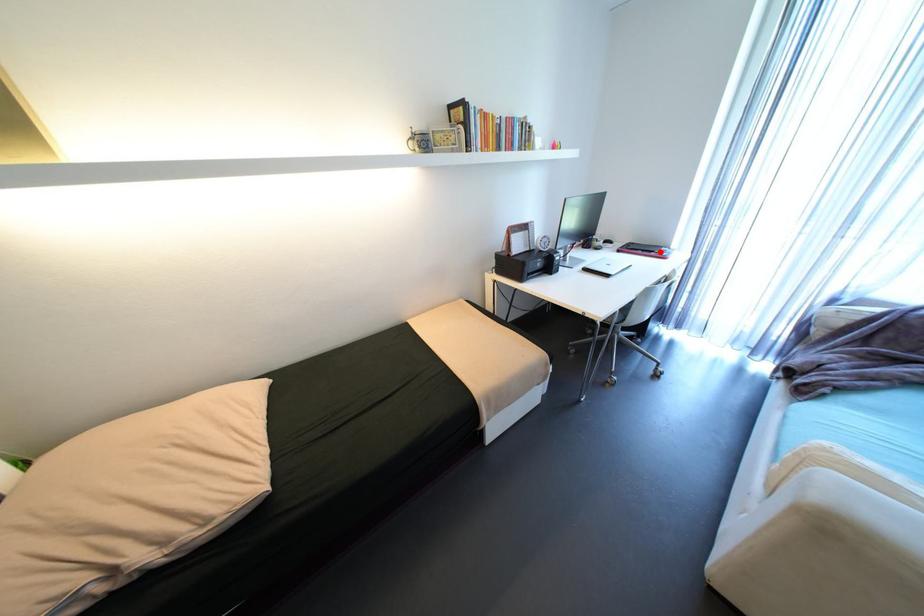
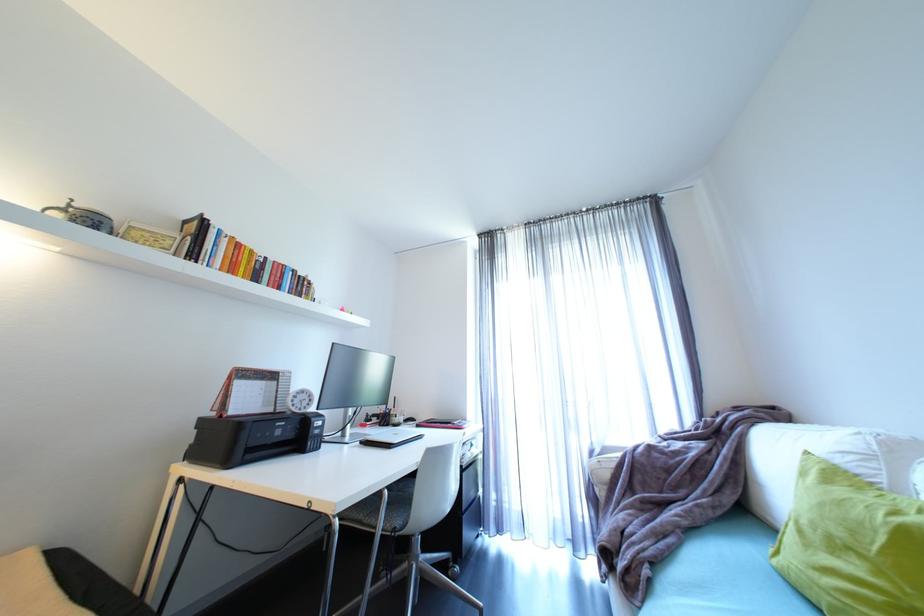
Where in the second image is the point corresponding to the highlighted location from the first image?

(457, 424)